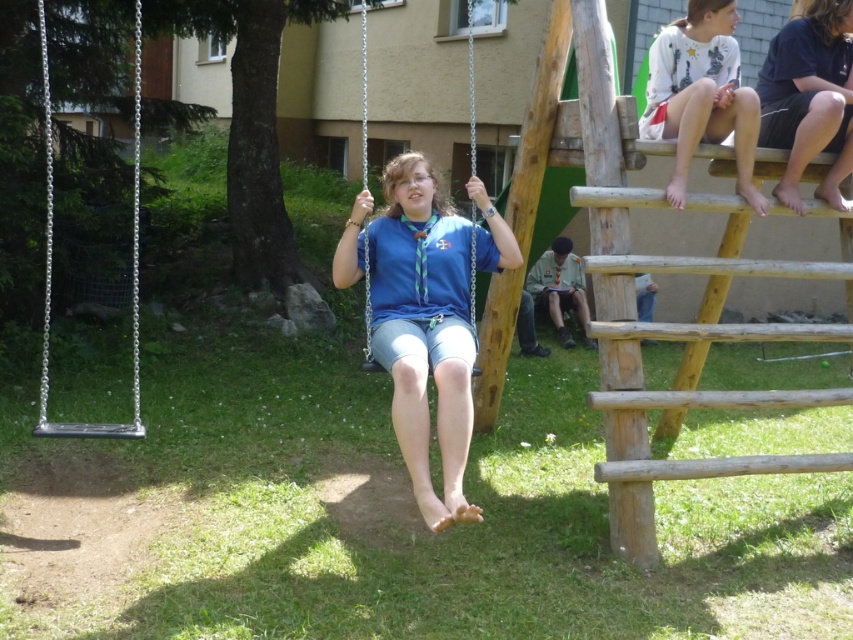
Question: Can you confirm if black cotton shorts at upper right is smaller than blue fabric swing at center?

Choices:
 (A) no
 (B) yes

Answer: (B)

Question: Which is farther from the white cotton shirt at upper right?

Choices:
 (A) silver metallic swing at left
 (B) blue cotton shirt at center
 (C) black cotton shorts at upper right

Answer: (A)

Question: Which point is farther from the camera taking this photo?

Choices:
 (A) (134, 157)
 (B) (468, 80)

Answer: (A)

Question: In this image, where is black cotton shorts at upper right located relative to silver metallic swing at left?

Choices:
 (A) right
 (B) left

Answer: (A)

Question: Does blue cotton shirt at center have a smaller size compared to silver metallic swing at left?

Choices:
 (A) yes
 (B) no

Answer: (A)

Question: Which object is farther from the camera taking this photo?

Choices:
 (A) black cotton shorts at upper right
 (B) silver metallic swing at left
 (C) blue cotton shirt at center
 (D) white cotton shirt at upper right

Answer: (A)